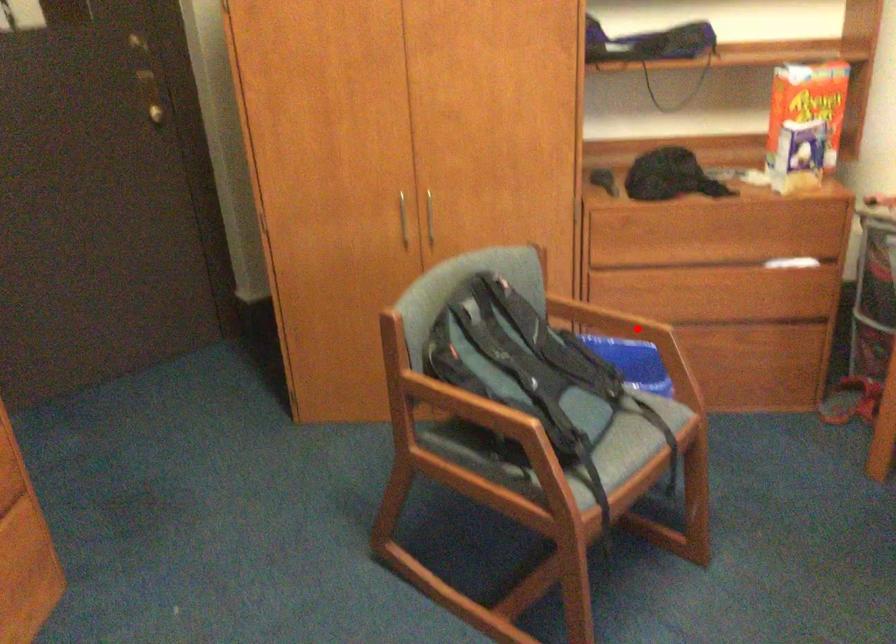
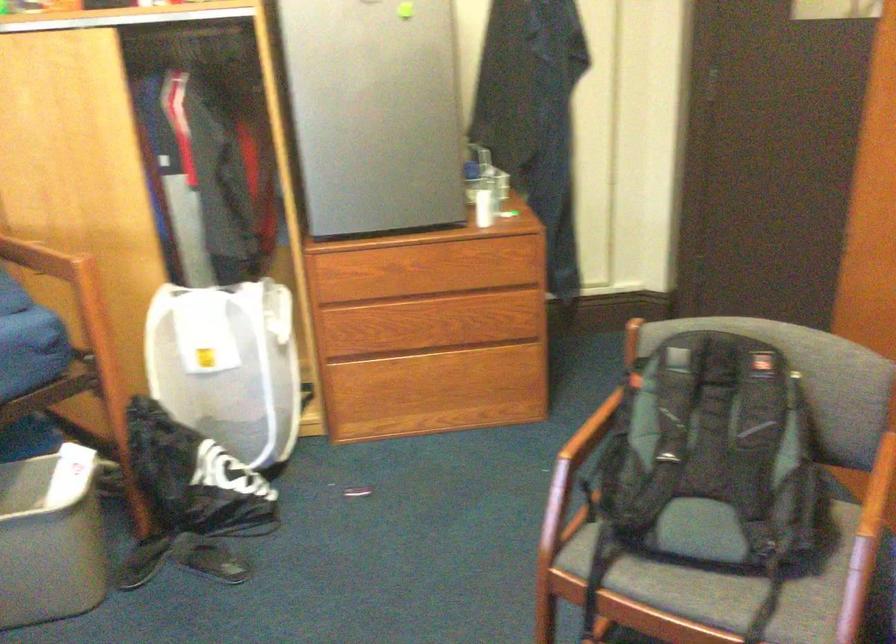
Question: I am providing you with two images of the same scene from different viewpoints. A red point is marked on the first image. Is the red point's position out of view in image 2?

Choices:
 (A) Yes
 (B) No

Answer: (B)